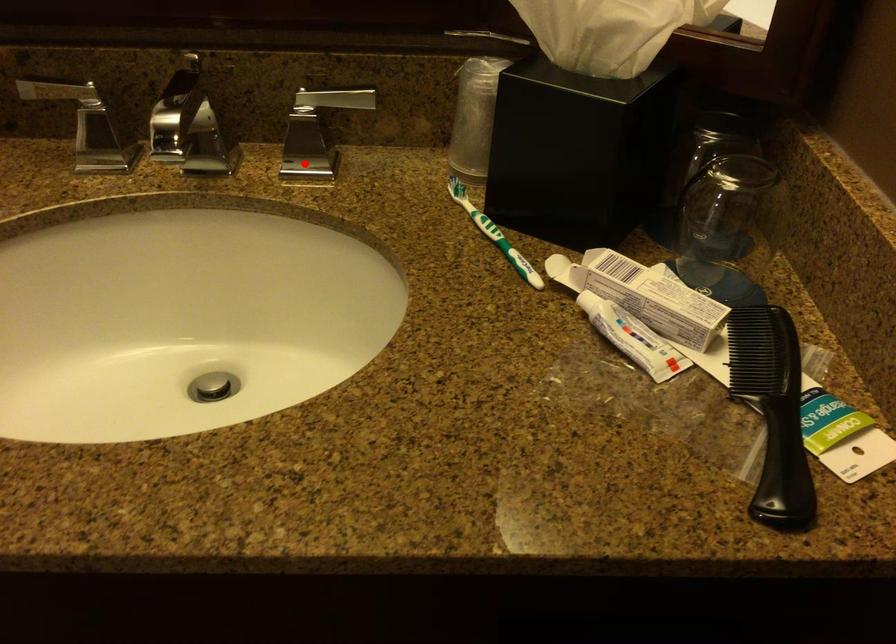
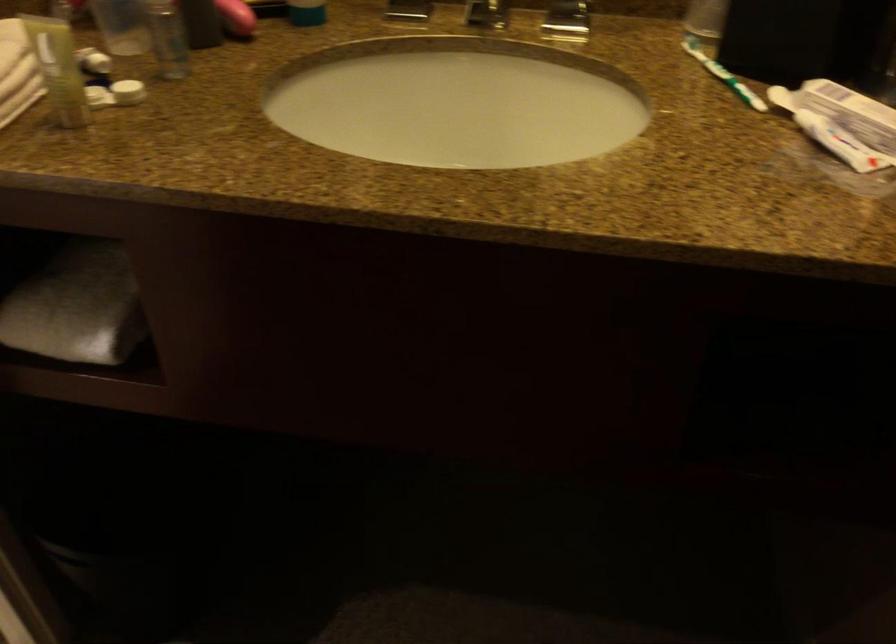
Question: A red point is marked in image1. In image2, is the corresponding 3D point closer to the camera or farther? Reply with the corresponding letter.

Choices:
 (A) The corresponding 3D point is closer.
 (B) The corresponding 3D point is farther.

Answer: (B)